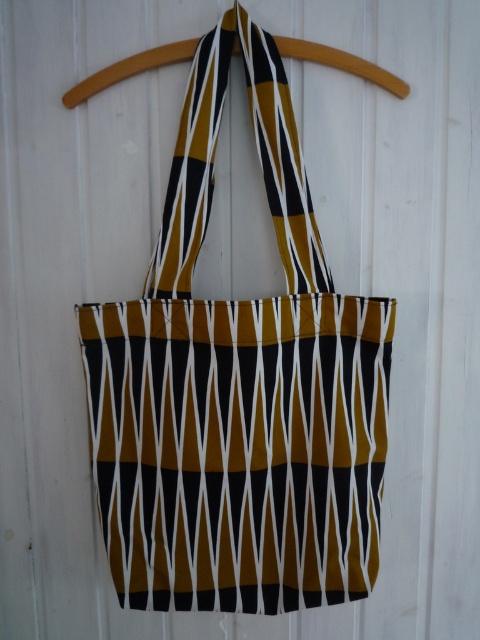
Question: Can you confirm if mustard and black striped tote at center is positioned below wooden hanger at center?

Choices:
 (A) yes
 (B) no

Answer: (A)

Question: Does mustard and black striped tote at center appear under wooden hanger at center?

Choices:
 (A) no
 (B) yes

Answer: (B)

Question: In this image, where is mustard and black striped tote at center located relative to wooden hanger at center?

Choices:
 (A) below
 (B) above

Answer: (A)